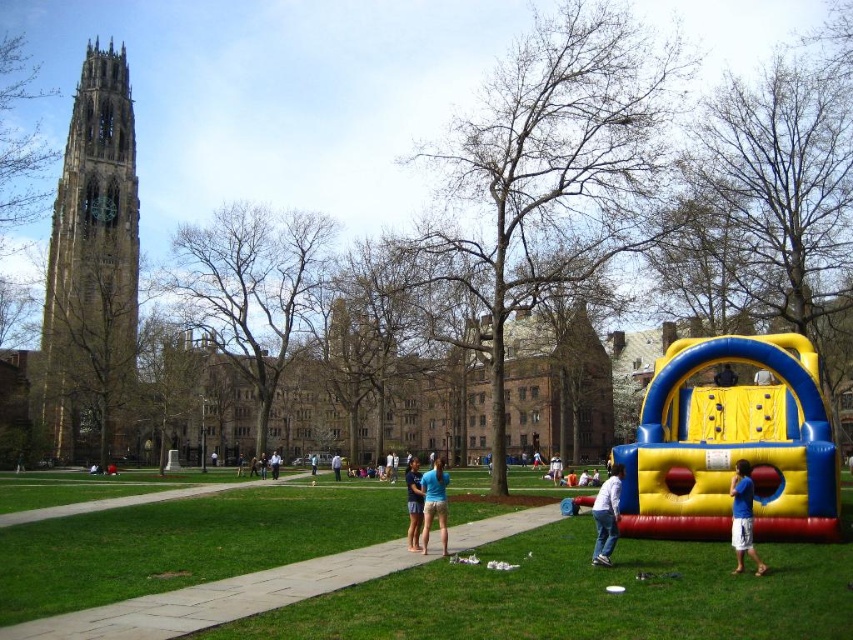
Looking at this image, who is more distant from viewer, (296,496) or (239,460)?

The point (239,460) is more distant.

Between green grass at lower center and blue t-shirt at center, which one has less height?

blue t-shirt at center is shorter.

Is point (236, 627) in front of point (241, 474)?

Yes, it is in front of point (241, 474).

Identify the location of green grass at lower center. This screenshot has width=853, height=640. (579, 593).

Image resolution: width=853 pixels, height=640 pixels. I want to click on golden stone tower at upper left, so click(91, 262).

Based on the photo, does green grass at lower center have a larger size compared to blue fabric bouncy house at center?

Correct, green grass at lower center is larger in size than blue fabric bouncy house at center.

Which is more to the left, green grass at lower center or blue fabric bouncy house at center?

green grass at lower center

The height and width of the screenshot is (640, 853). What are the coordinates of `green grass at lower center` in the screenshot? It's located at (579, 593).

The height and width of the screenshot is (640, 853). I want to click on green grass at lower center, so click(579, 593).